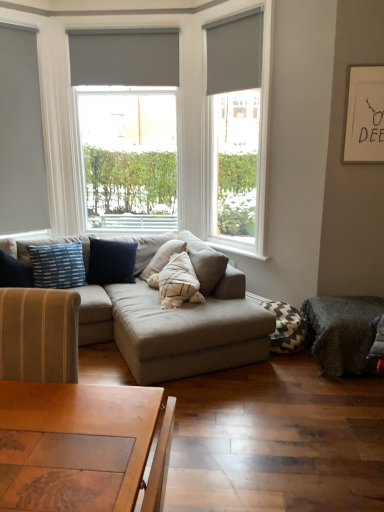
Identify the location of free space in front of chevron-patterned fabric pillow at lower right, the 1th pillow when ordered from right to left. The width and height of the screenshot is (384, 512). (283, 368).